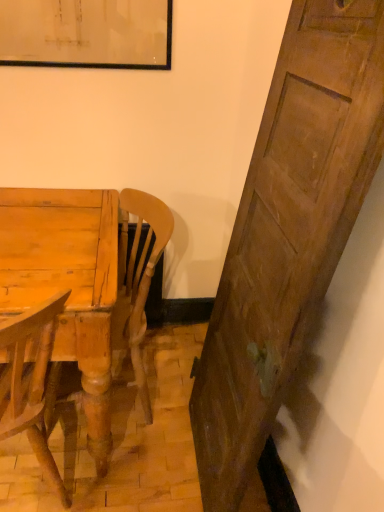
What do you see at coordinates (67, 283) in the screenshot?
I see `light brown wood desk at lower left` at bounding box center [67, 283].

Image resolution: width=384 pixels, height=512 pixels. In order to click on light brown wood desk at lower left in this screenshot , I will do `click(67, 283)`.

From the picture: In order to face light brown wood desk at lower left, should I rotate leftwards or rightwards?

Rotate left and turn 19.381 degrees.

At what (x,y) coordinates should I click in order to perform the action: click on light brown wood desk at lower left. Please return your answer as a coordinate pair (x, y). This screenshot has width=384, height=512. Looking at the image, I should click on (67, 283).